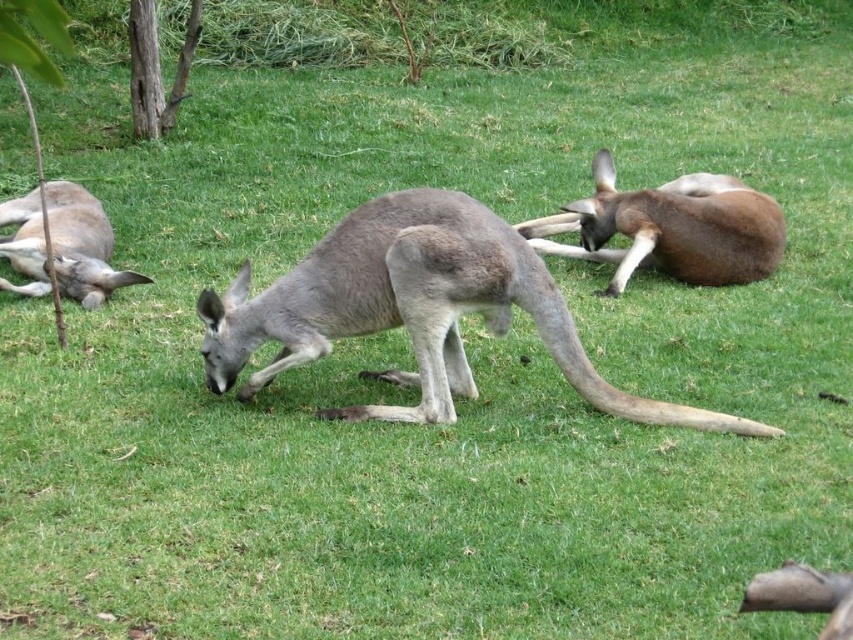
Question: Which is farther from the brown fur kangaroo at center?

Choices:
 (A) gray fur kangaroo at left
 (B) gray fur kangaroo at center

Answer: (A)

Question: Which of these objects is positioned closest to the gray fur kangaroo at left?

Choices:
 (A) gray fur kangaroo at center
 (B) brown fur kangaroo at center

Answer: (A)

Question: Which point is farther from the camera taking this photo?

Choices:
 (A) (257, 308)
 (B) (51, 227)
 (C) (689, 243)

Answer: (C)

Question: Observing the image, what is the correct spatial positioning of gray fur kangaroo at center in reference to brown fur kangaroo at center?

Choices:
 (A) left
 (B) right

Answer: (A)

Question: Can you confirm if brown fur kangaroo at center is positioned below gray fur kangaroo at left?

Choices:
 (A) no
 (B) yes

Answer: (A)

Question: Can you confirm if gray fur kangaroo at center is wider than brown fur kangaroo at center?

Choices:
 (A) no
 (B) yes

Answer: (B)